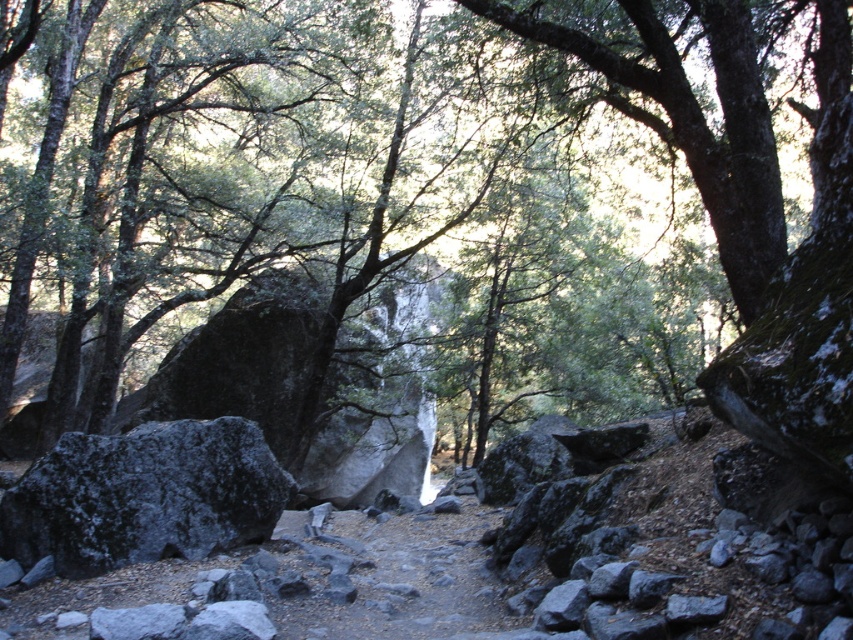
Does green mossy rock at center come in front of gray rough rock at left?

Yes.

Can you confirm if green mossy rock at center is taller than gray rough rock at left?

Yes.

Between point (759, 42) and point (228, 426), which one is positioned in front?

Point (228, 426) is in front.

Identify the location of green mossy rock at center. Image resolution: width=853 pixels, height=640 pixels. (416, 179).